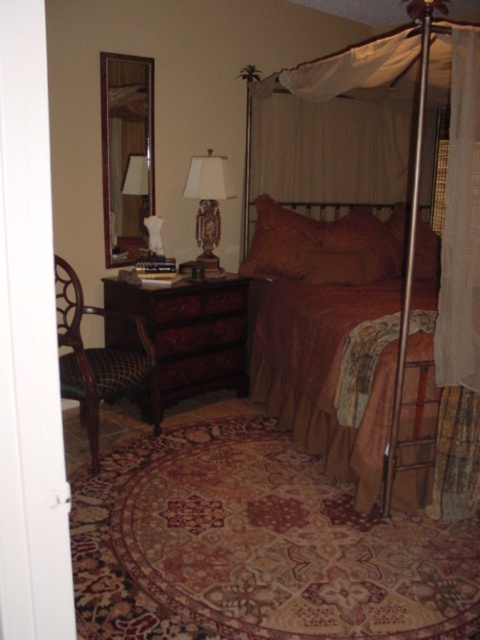
Question: Does matte brown wood lamp at center have a larger size compared to brown wood drawer at left?

Choices:
 (A) no
 (B) yes

Answer: (B)

Question: Which object is positioned closest to the sheer white curtain at right?

Choices:
 (A) matte brown wood lamp at center
 (B) mahogany wood dresser at center left
 (C) brown textured pillow at center

Answer: (C)

Question: Is mahogany wood dresser at center left closer to camera compared to green plaid chair at left?

Choices:
 (A) no
 (B) yes

Answer: (A)

Question: Among these objects, which one is nearest to the camera?

Choices:
 (A) brown textured pillow at center
 (B) brown wood drawer at center
 (C) green plaid chair at left
 (D) matte brown wood lamp at center

Answer: (C)

Question: Is mahogany wood dresser at center left in front of brown wood drawer at left?

Choices:
 (A) yes
 (B) no

Answer: (A)

Question: Which object appears closest to the camera in this image?

Choices:
 (A) green plaid chair at left
 (B) matte brown wood lamp at center

Answer: (A)